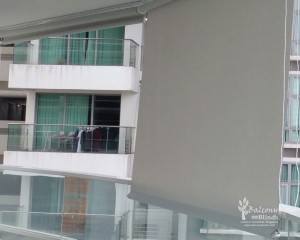
Locate an element on the screen. The width and height of the screenshot is (300, 240). handle to pull up privacy screen is located at coordinates (194, 210).